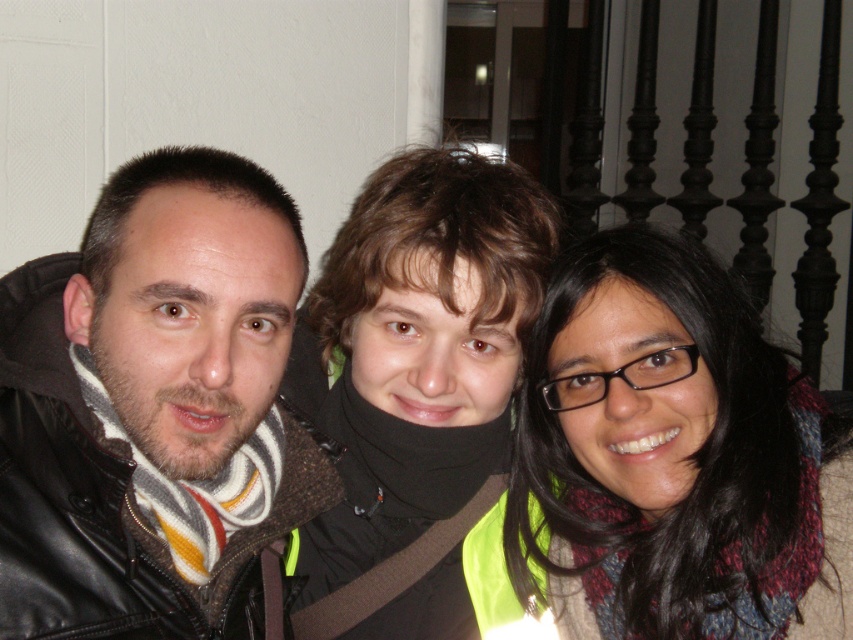
Question: Among these points, which one is farthest from the camera?

Choices:
 (A) (633, 397)
 (B) (477, 161)

Answer: (B)

Question: Can you confirm if leather jacket at left is thinner than multicolored scarf at right?

Choices:
 (A) no
 (B) yes

Answer: (B)

Question: Which of these objects is positioned closest to the black matte scarf at center?

Choices:
 (A) multicolored scarf at right
 (B) leather jacket at left

Answer: (A)

Question: Does leather jacket at left have a larger size compared to multicolored scarf at right?

Choices:
 (A) yes
 (B) no

Answer: (B)

Question: Which object is positioned farthest from the leather jacket at left?

Choices:
 (A) black matte scarf at center
 (B) multicolored scarf at right

Answer: (B)

Question: Does leather jacket at left appear on the left side of black matte scarf at center?

Choices:
 (A) yes
 (B) no

Answer: (A)